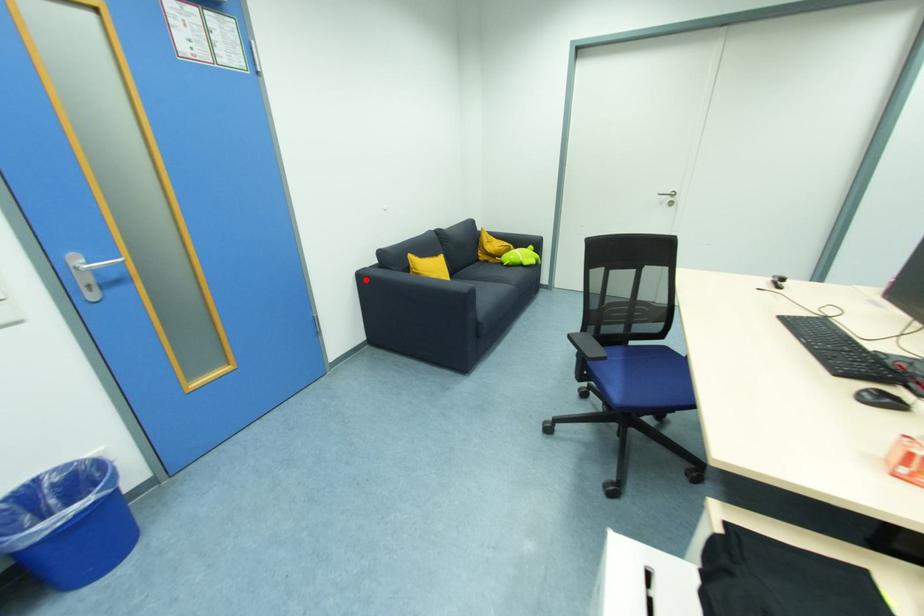
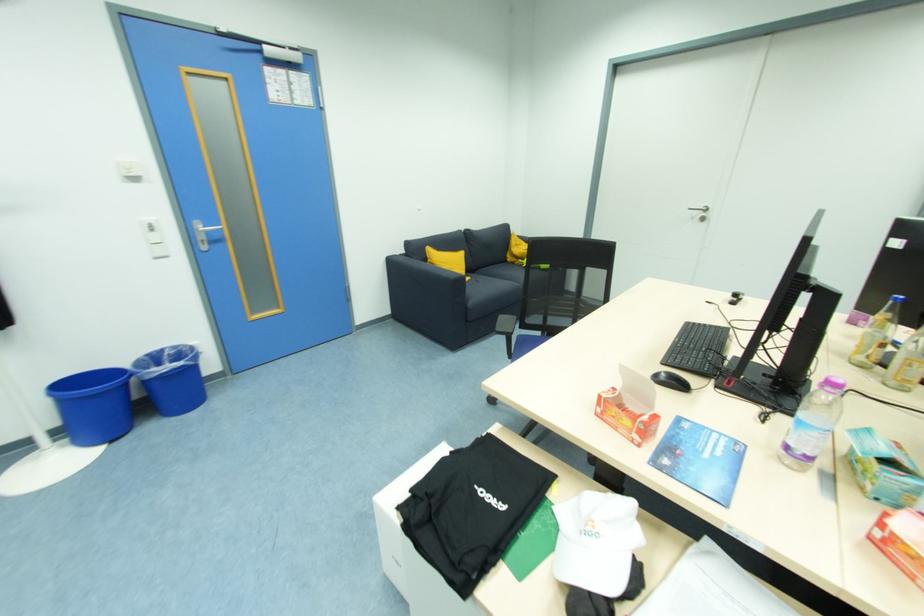
In the second image, find the point that corresponds to the highlighted location in the first image.

(395, 265)